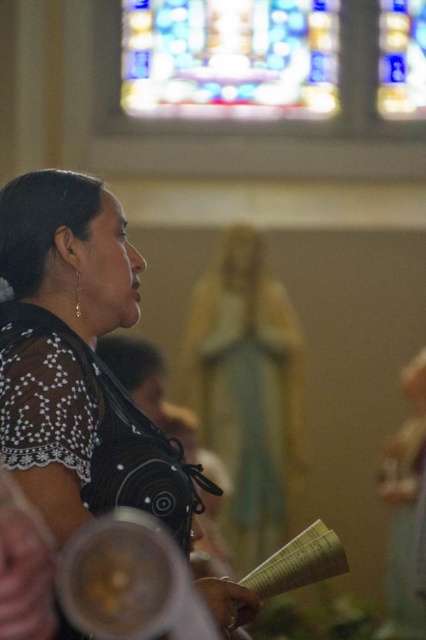
You are standing in the church and want to take a photo of both the black lace dress at left and the stained glass window at upper center. Can you frame both in the same shot without moving your position?

The black lace dress at left is below the stained glass window at upper center, so yes, you can frame both in the same shot by adjusting your camera angle to include both the lower and upper areas of the scene.

You are an interior designer planning to install a new lighting fixture. You notice the stained glass window at upper center and the white paper book at lower center. Which object would cast a larger shadow if both are illuminated by the same light source?

The stained glass window at upper center is larger in size than the white paper book at lower center, so it would cast a larger shadow when illuminated by the same light source.